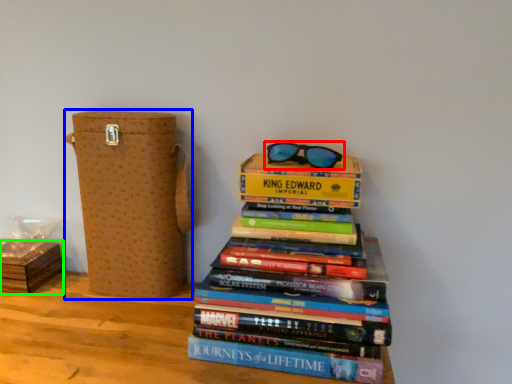
Question: Which object is positioned closest to glasses (highlighted by a red box)? Select from cardboard box (highlighted by a blue box) and cardboard box (highlighted by a green box).

Choices:
 (A) cardboard box
 (B) cardboard box

Answer: (A)